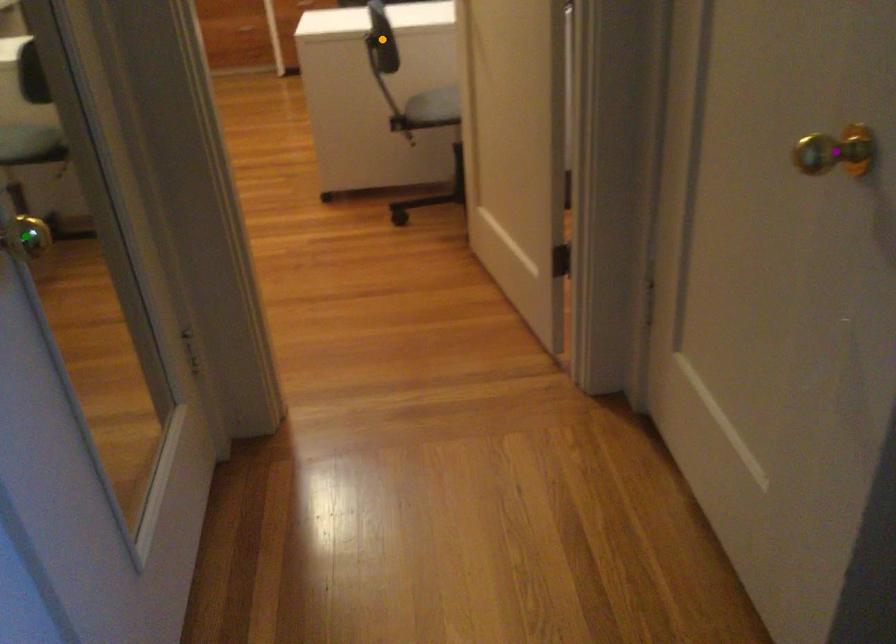
Order these from nearest to farthest:
1. orange point
2. green point
3. purple point

purple point
orange point
green point